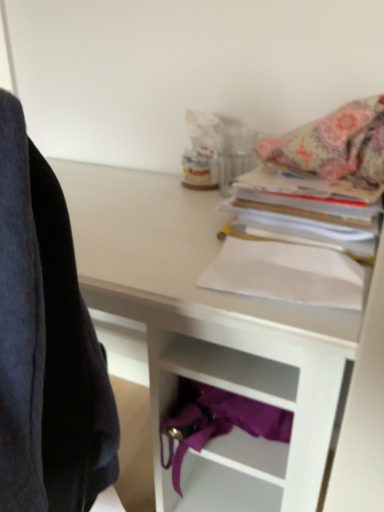
Question: From a real-world perspective, is white paper at upper right, which is counted as the first paperback book, starting from the top, positioned over white paper at center, placed as the 1th paperback book when sorted from bottom to top, based on gravity?

Choices:
 (A) yes
 (B) no

Answer: (A)

Question: Is the position of white paper at upper right, the second paperback book ordered from the bottom, more distant than that of white paper at center, positioned as the 2th paperback book in top-to-bottom order?

Choices:
 (A) no
 (B) yes

Answer: (B)

Question: From a real-world perspective, does white paper at upper right, which is counted as the first paperback book, starting from the top, sit lower than white paper at center, positioned as the 2th paperback book in top-to-bottom order?

Choices:
 (A) no
 (B) yes

Answer: (A)

Question: Would you consider white paper at upper right, which is counted as the first paperback book, starting from the top, to be distant from white paper at center, placed as the 1th paperback book when sorted from bottom to top?

Choices:
 (A) no
 (B) yes

Answer: (A)

Question: Can you confirm if white paper at upper right, the second paperback book ordered from the bottom, is positioned to the left of white paper at center, placed as the 1th paperback book when sorted from bottom to top?

Choices:
 (A) no
 (B) yes

Answer: (A)

Question: From the image's perspective, is white matte desk at upper center positioned above or below patterned fabric blanket at upper right?

Choices:
 (A) below
 (B) above

Answer: (A)

Question: Looking at their shapes, would you say white matte desk at upper center is wider or thinner than patterned fabric blanket at upper right?

Choices:
 (A) wide
 (B) thin

Answer: (A)

Question: From a real-world perspective, relative to patterned fabric blanket at upper right, is white matte desk at upper center vertically above or below?

Choices:
 (A) above
 (B) below

Answer: (B)

Question: In terms of size, does white matte desk at upper center appear bigger or smaller than patterned fabric blanket at upper right?

Choices:
 (A) big
 (B) small

Answer: (A)

Question: Is patterned fabric blanket at upper right bigger or smaller than white paper at upper right, the second paperback book ordered from the bottom?

Choices:
 (A) big
 (B) small

Answer: (B)

Question: Looking at their shapes, would you say patterned fabric blanket at upper right is wider or thinner than white paper at upper right, which is counted as the first paperback book, starting from the top?

Choices:
 (A) thin
 (B) wide

Answer: (A)

Question: Is patterned fabric blanket at upper right inside or outside of white paper at upper right, the second paperback book ordered from the bottom?

Choices:
 (A) inside
 (B) outside

Answer: (B)

Question: Relative to white paper at upper right, the second paperback book ordered from the bottom, is patterned fabric blanket at upper right in front or behind?

Choices:
 (A) behind
 (B) front

Answer: (A)

Question: From a real-world perspective, is white paper at center, positioned as the 2th paperback book in top-to-bottom order, physically located above or below white paper at upper right, the second paperback book ordered from the bottom?

Choices:
 (A) above
 (B) below

Answer: (B)

Question: Would you say white paper at center, placed as the 1th paperback book when sorted from bottom to top, is to the left or to the right of white paper at upper right, which is counted as the first paperback book, starting from the top, in the picture?

Choices:
 (A) right
 (B) left

Answer: (B)